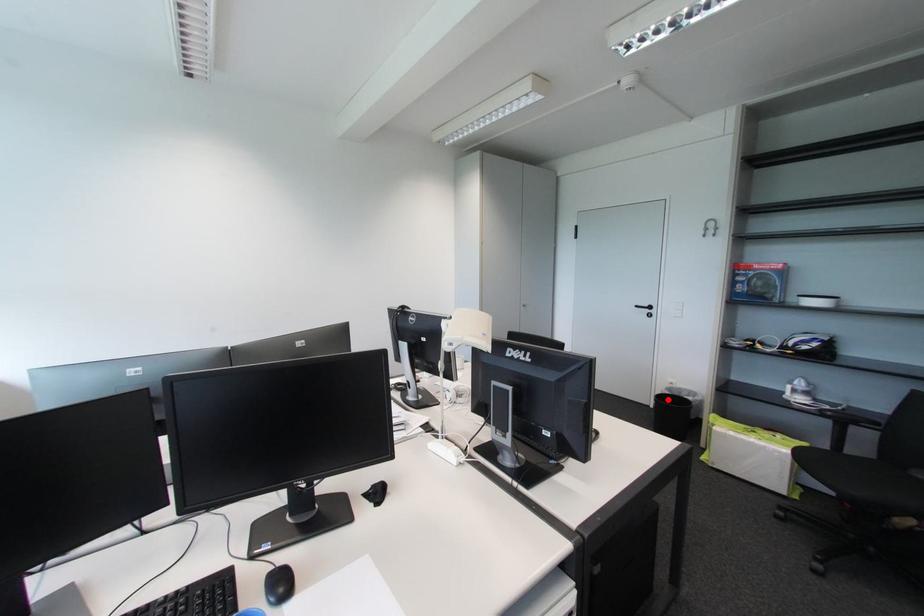
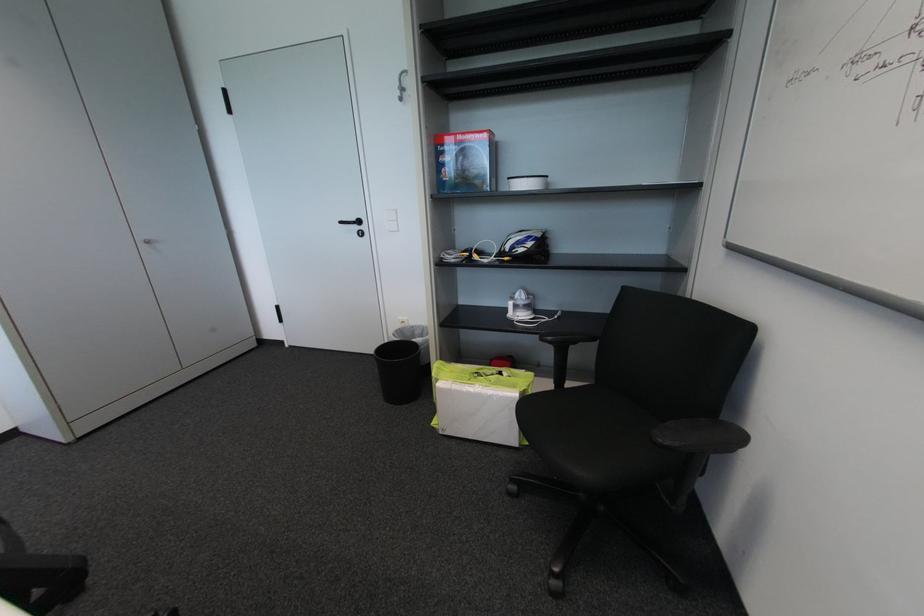
Question: I am providing you with two images of the same scene from different viewpoints. A red point is shown in image1. For the corresponding object point in image2, is it positioned nearer or farther from the camera?

Choices:
 (A) Nearer
 (B) Farther

Answer: (B)